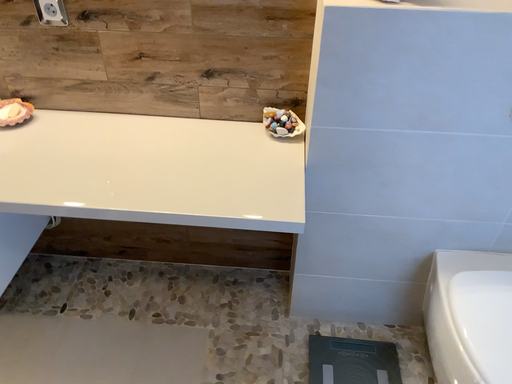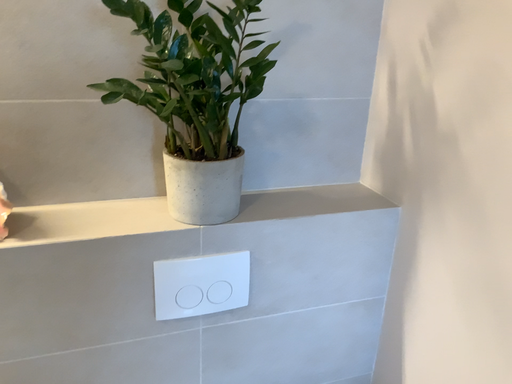
Question: How did the camera likely rotate when shooting the video?

Choices:
 (A) rotated right
 (B) rotated left

Answer: (A)